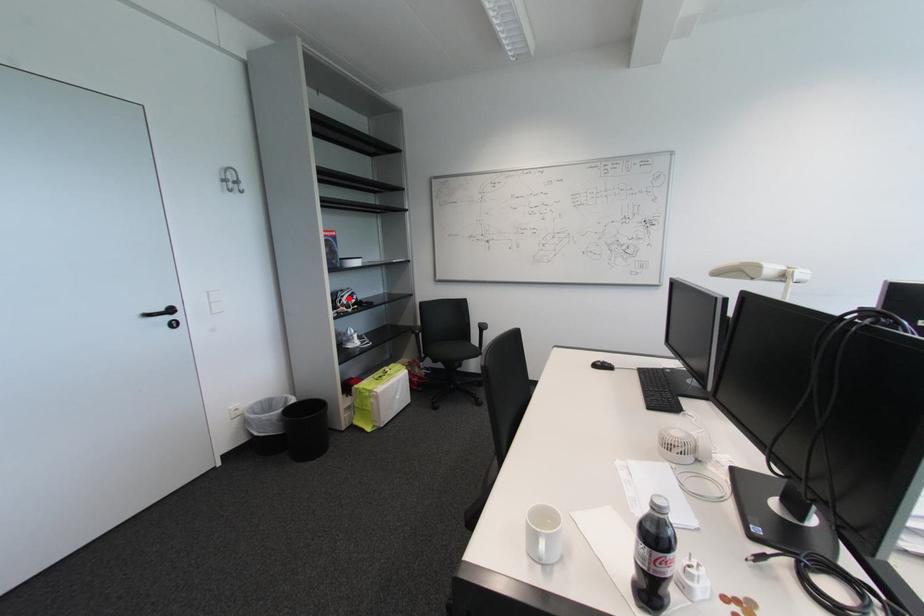
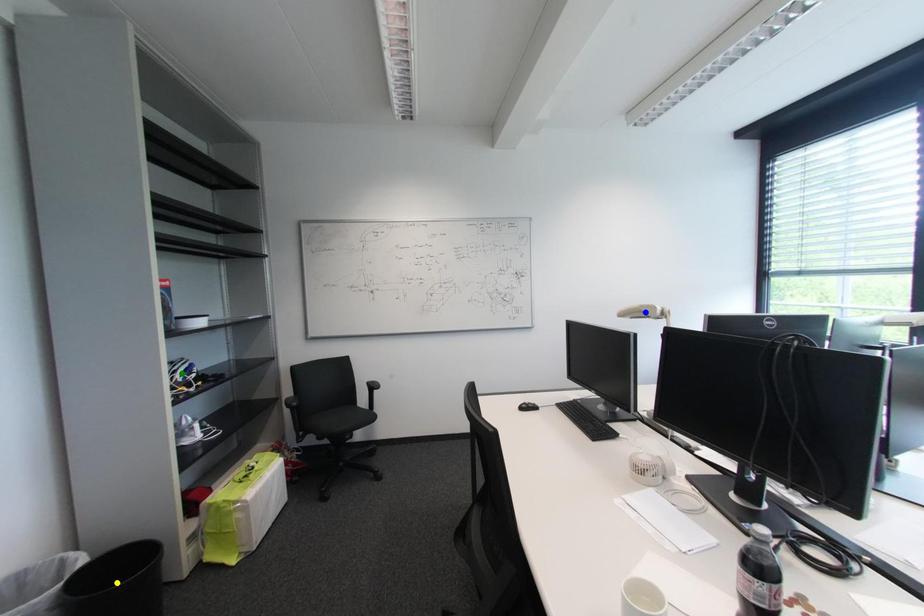
Question: I am providing you with two images of the same scene from different viewpoints. A red point is marked on the first image. You are given multiple points on the second image. Which spot in image 2 lines up with the point in image 1?

Choices:
 (A) green point
 (B) blue point
 (C) yellow point

Answer: (A)